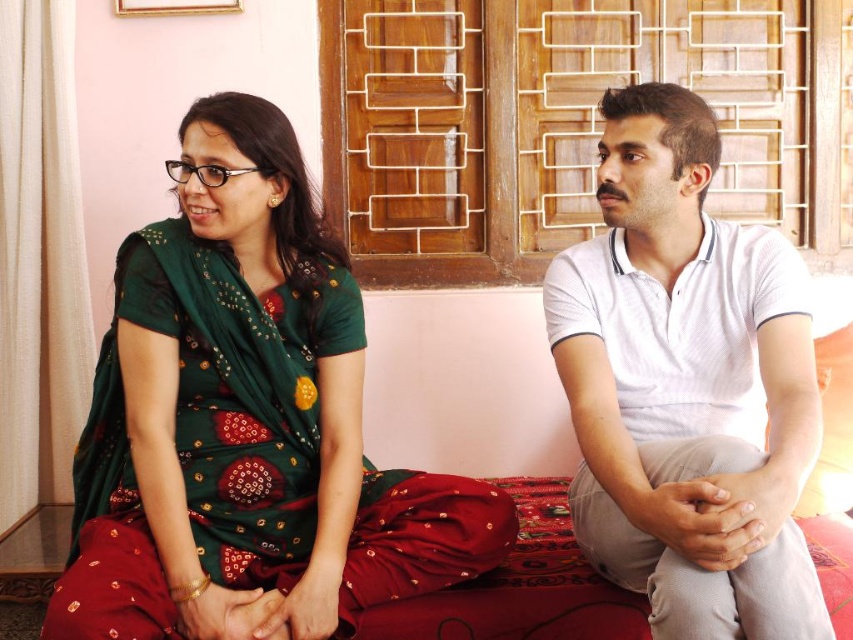
Does point (457, 488) come in front of point (654, 92)?

No, (457, 488) is further to viewer.

Between green embroidered saree at left and white cotton shirt at center, which one appears on the right side from the viewer's perspective?

Positioned to the right is white cotton shirt at center.

The width and height of the screenshot is (853, 640). In order to click on green embroidered saree at left in this screenshot , I will do `click(247, 420)`.

At what (x,y) coordinates should I click in order to perform the action: click on green embroidered saree at left. Please return your answer as a coordinate pair (x, y). The image size is (853, 640). Looking at the image, I should click on (247, 420).